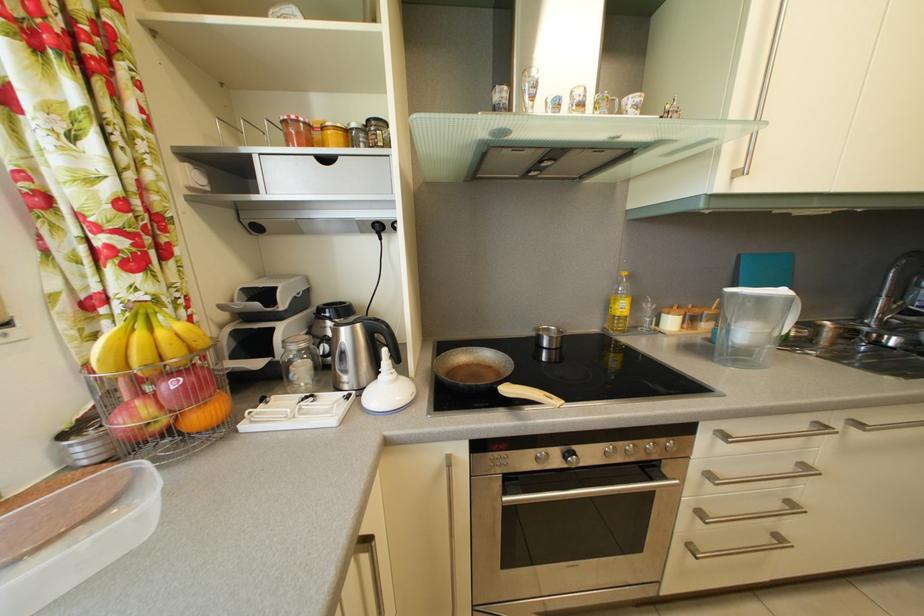
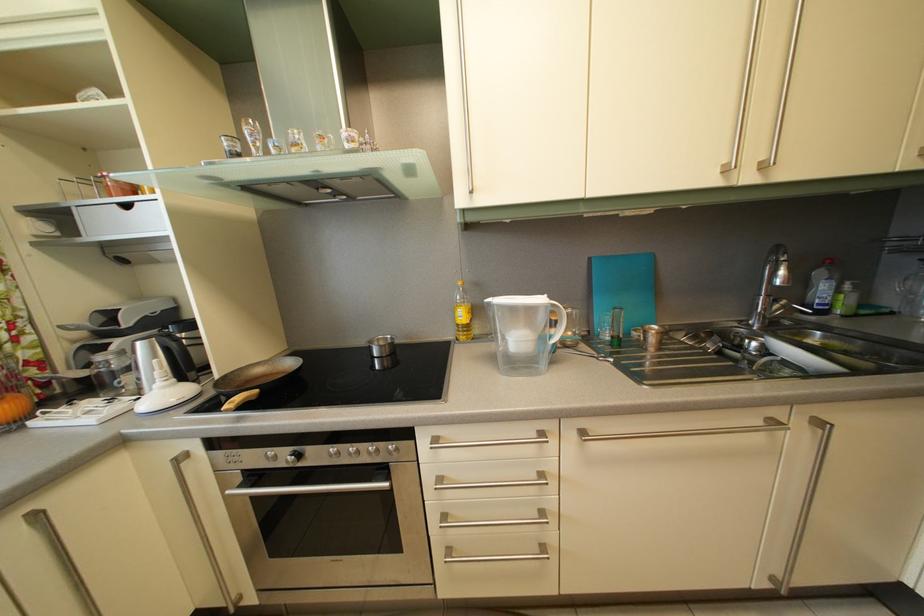
Question: Which direction would the cameraman need to move to produce the second image? Reply with the corresponding letter.

Choices:
 (A) Left
 (B) Right
 (C) Forward
 (D) Backward

Answer: (B)